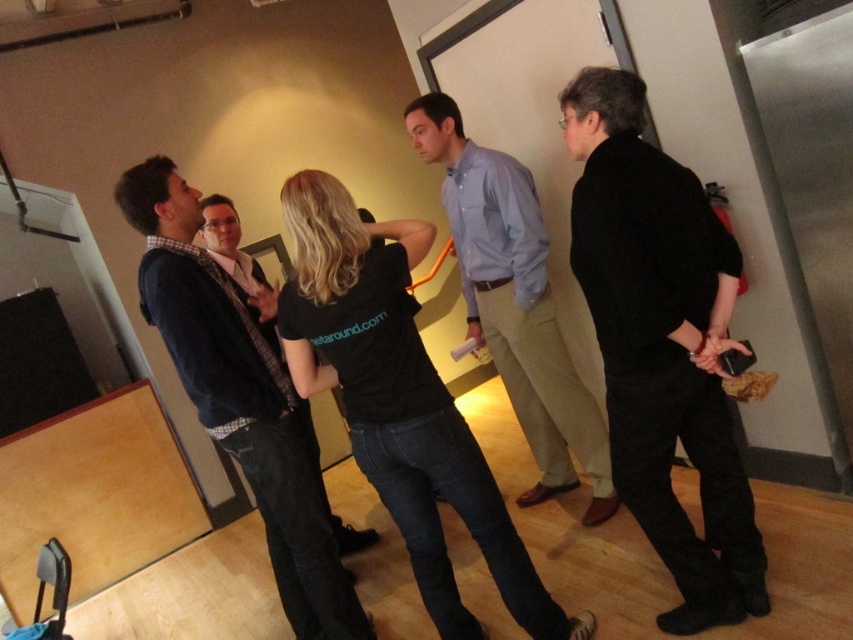
You are standing in the room and want to reach a point that is 6.20 feet away from you. Is the point at coordinates point(695,188) within that distance?

The distance of point(695,188) from viewer is 6.20 feet, so yes, the point at coordinates point(695,188) is exactly 6.20 feet away from you.